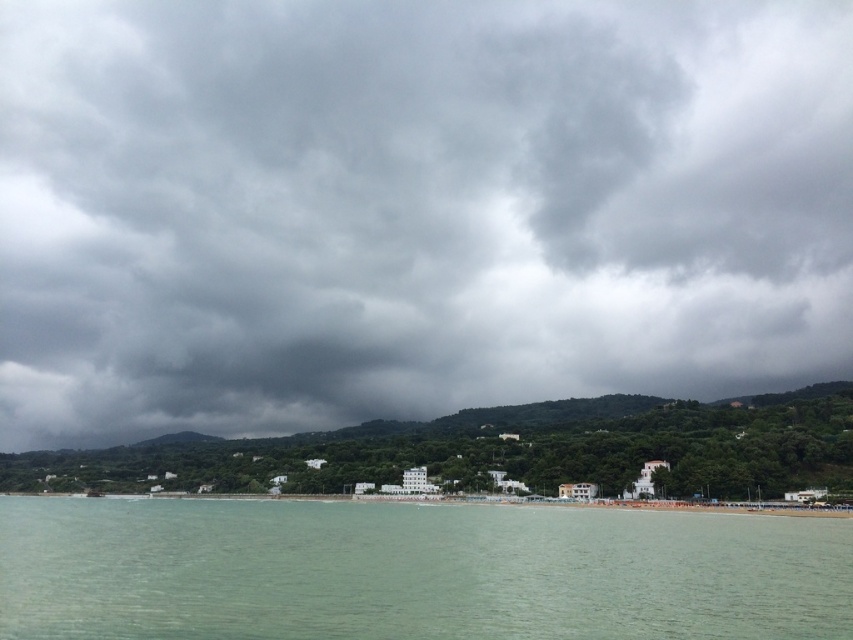
Does dark gray cloud at upper center appear on the left side of clear water at lower center?

Yes, dark gray cloud at upper center is to the left of clear water at lower center.

Between point (840, 68) and point (161, 611), which one is positioned behind?

Positioned behind is point (840, 68).

You are a GUI agent. You are given a task and a screenshot of the screen. Output one action in this format:
    pyautogui.click(x=<x>, y=<y>)
    Task: Click on the dark gray cloud at upper center
    
    Given the screenshot: What is the action you would take?
    pyautogui.click(x=412, y=209)